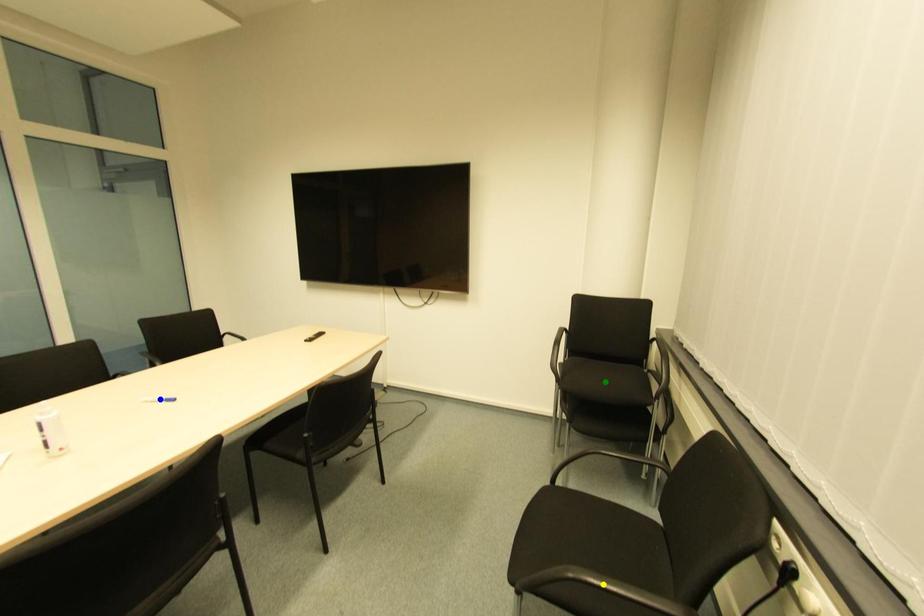
Order these from nearest to farthest:
blue point | yellow point | green point

1. yellow point
2. blue point
3. green point